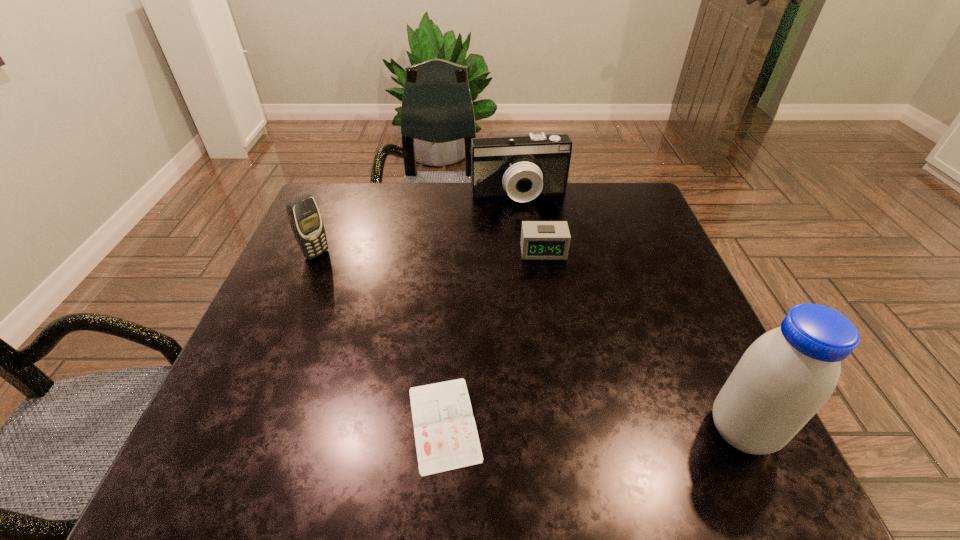
Identify the location of vacant area that satisfies the following two spatial constraints: 1. on the front side of the cellular telephone; 2. on the right side of the shortest object. This screenshot has width=960, height=540. (246, 423).

The height and width of the screenshot is (540, 960). What are the coordinates of `vacant region that satisfies the following two spatial constraints: 1. on the back side of the diary; 2. on the right side of the farthest object` in the screenshot? It's located at (459, 196).

You are a GUI agent. You are given a task and a screenshot of the screen. Output one action in this format:
    pyautogui.click(x=<x>, y=<y>)
    Task: Click on the vacant space that satisfies the following two spatial constraints: 1. on the back side of the camcorder; 2. on the left side of the cellular telephone
    
    Given the screenshot: What is the action you would take?
    pyautogui.click(x=341, y=196)

This screenshot has height=540, width=960. I want to click on free space that satisfies the following two spatial constraints: 1. on the front side of the camcorder; 2. on the left side of the rightmost object, so click(546, 430).